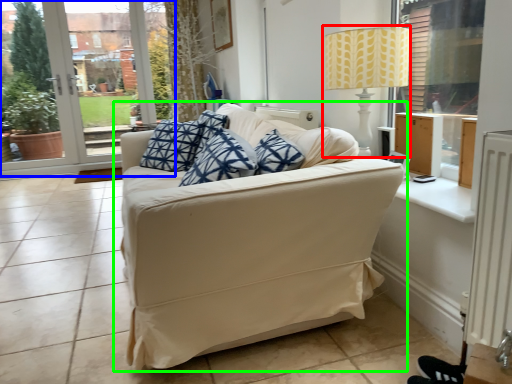
Question: Which object is positioned closest to table lamp (highlighted by a red box)? Select from window frame (highlighted by a blue box) and studio couch (highlighted by a green box).

Choices:
 (A) window frame
 (B) studio couch

Answer: (B)